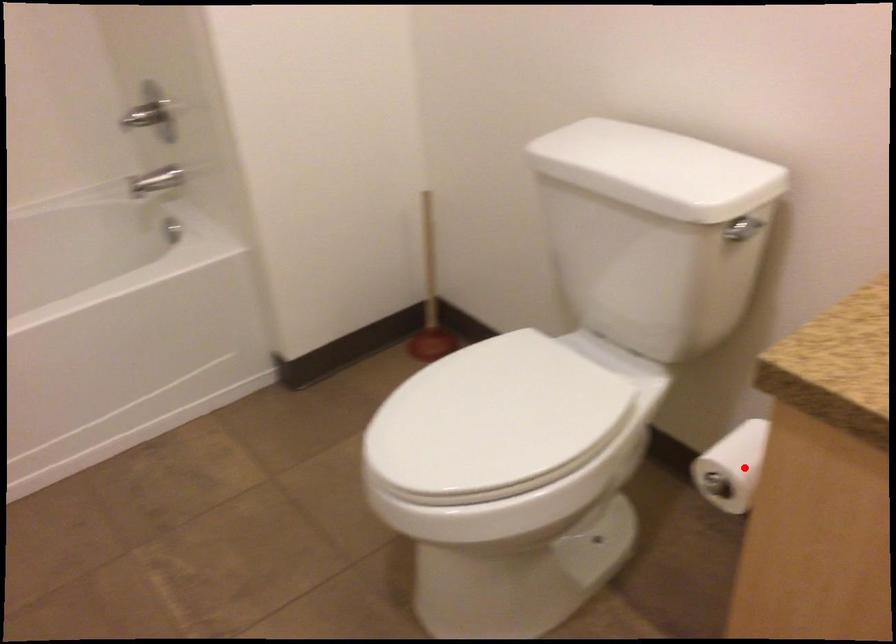
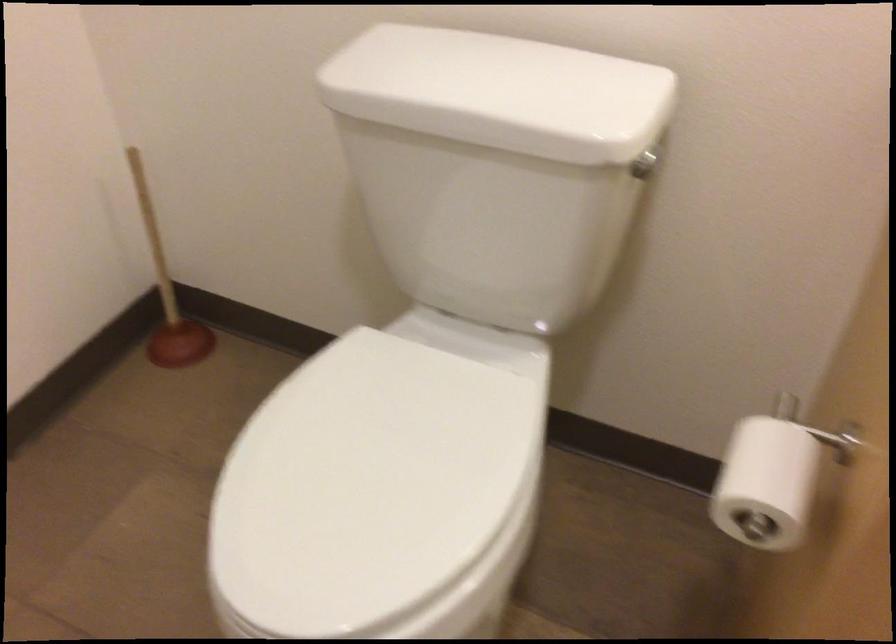
Question: A red point is marked in image1. In image2, is the corresponding 3D point closer to the camera or farther? Reply with the corresponding letter.

Choices:
 (A) The corresponding 3D point is closer.
 (B) The corresponding 3D point is farther.

Answer: (A)